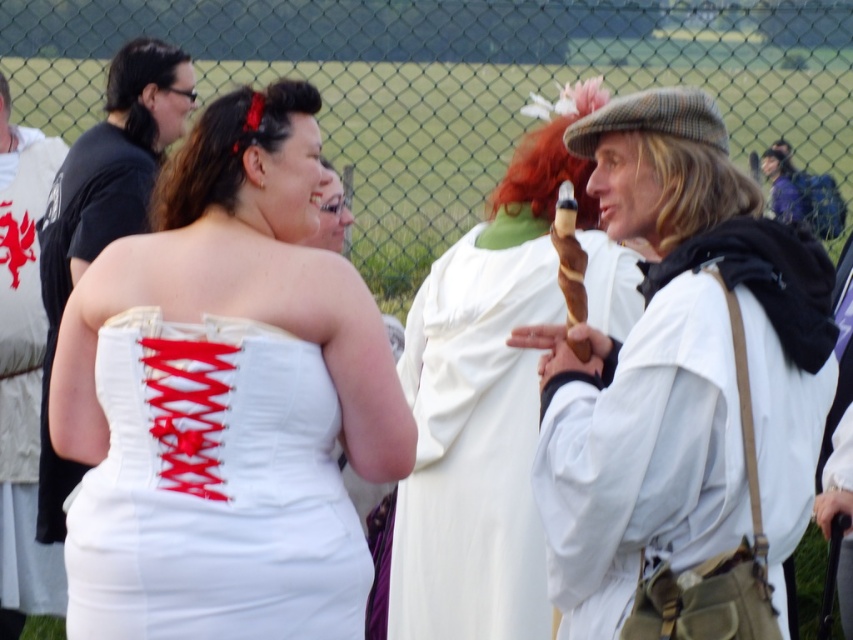
Is point (701, 150) closer to viewer compared to point (125, 353)?

No, it is not.

Can you confirm if matte white dress at center is positioned to the right of white satin corset at center?

Yes, matte white dress at center is to the right of white satin corset at center.

Between point (822, 385) and point (113, 620), which one is positioned behind?

Point (822, 385)

Where is `matte white dress at center`? Image resolution: width=853 pixels, height=640 pixels. matte white dress at center is located at coordinates (677, 369).

From the picture: Does white satin corset at center have a greater height compared to white cloth at center?

In fact, white satin corset at center may be shorter than white cloth at center.

Who is shorter, white satin corset at center or white cloth at center?

white satin corset at center

Does point (184, 524) lie in front of point (589, 250)?

Yes.

Identify the location of white satin corset at center. The width and height of the screenshot is (853, 640). (213, 490).

Can you confirm if matte white dress at center is wider than white satin corset at left?

Yes.

Between matte white dress at center and white satin corset at left, which one appears on the left side from the viewer's perspective?

white satin corset at left is more to the left.

This screenshot has height=640, width=853. In order to click on matte white dress at center in this screenshot , I will do `click(677, 369)`.